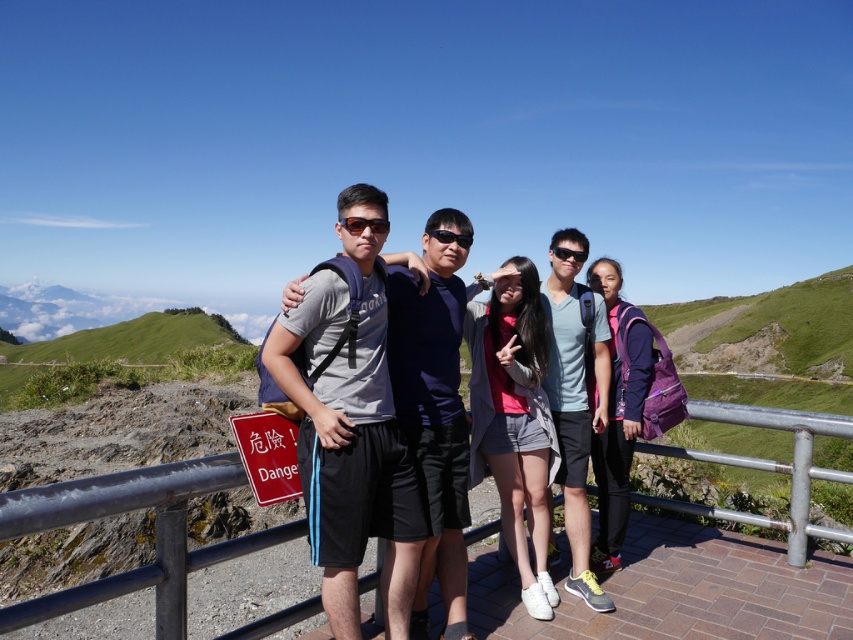
Question: Is brushed metal rail at center smaller than black plastic goggles at center?

Choices:
 (A) yes
 (B) no

Answer: (B)

Question: Considering the real-world distances, which object is farthest from the black matte sunglasses at center?

Choices:
 (A) brushed metal rail at center
 (B) matte gray t-shirt at center
 (C) matte gray shirt at center

Answer: (A)

Question: Estimate the real-world distances between objects in this image. Which object is closer to the matte gray t-shirt at center?

Choices:
 (A) matte gray shirt at center
 (B) brushed metal rail at center

Answer: (A)

Question: Does matte gray t-shirt at center have a greater width compared to black matte sunglasses at center?

Choices:
 (A) yes
 (B) no

Answer: (A)

Question: Does brushed metal rail at center have a greater width compared to matte gray shirt at center?

Choices:
 (A) yes
 (B) no

Answer: (A)

Question: Which of the following is the closest to the observer?

Choices:
 (A) (750, 406)
 (B) (451, 572)
 (C) (567, 401)

Answer: (B)